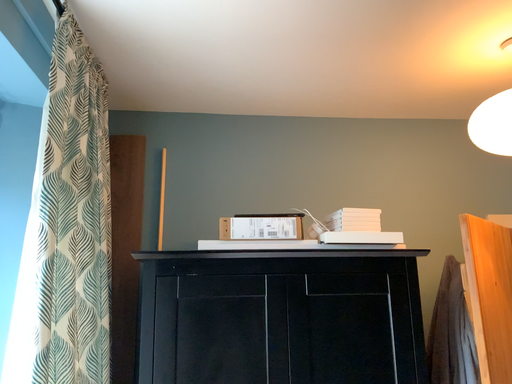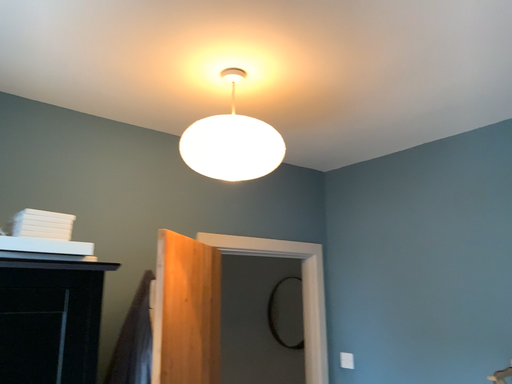
Question: How did the camera likely rotate when shooting the video?

Choices:
 (A) rotated right
 (B) rotated left

Answer: (A)